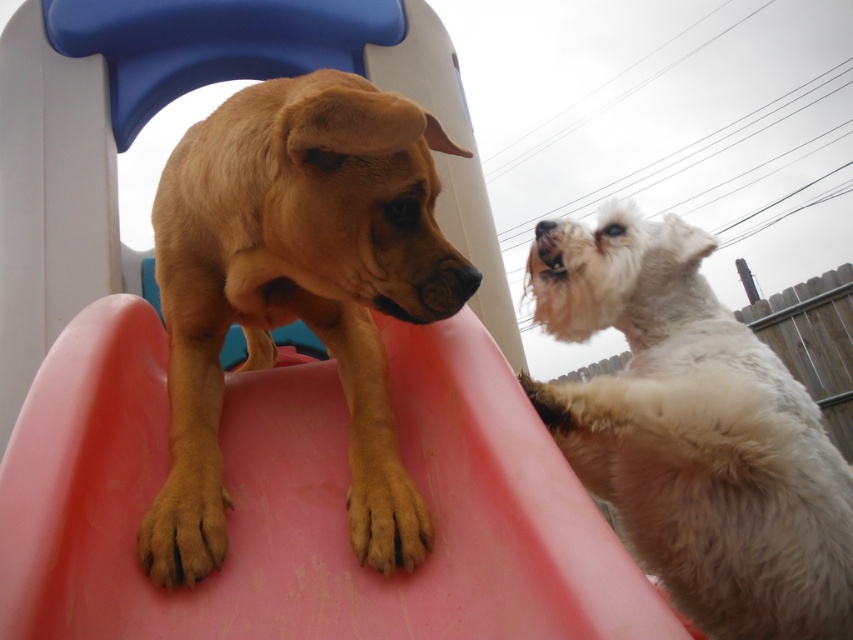
Locate an element on the screen. pink plastic slide at center is located at coordinates (303, 500).

Does pink plastic slide at center have a greater width compared to brown matte paw at lower center?

Correct, the width of pink plastic slide at center exceeds that of brown matte paw at lower center.

Is point (74, 620) less distant than point (404, 563)?

Yes.

The height and width of the screenshot is (640, 853). In order to click on pink plastic slide at center in this screenshot , I will do `click(303, 500)`.

Is pink plastic slide at center closer to camera compared to white fur nose at upper center?

Yes, it is.

Does pink plastic slide at center have a larger size compared to white fur nose at upper center?

Yes.

This screenshot has height=640, width=853. Identify the location of pink plastic slide at center. (303, 500).

Does golden brown fur at center have a larger size compared to white fluffy dog at upper right?

No.

Does golden brown fur at center lie in front of white fluffy dog at upper right?

Yes, golden brown fur at center is in front of white fluffy dog at upper right.

Does point (415, 563) come farther from viewer compared to point (775, 625)?

No.

I want to click on golden brown fur at center, so click(297, 291).